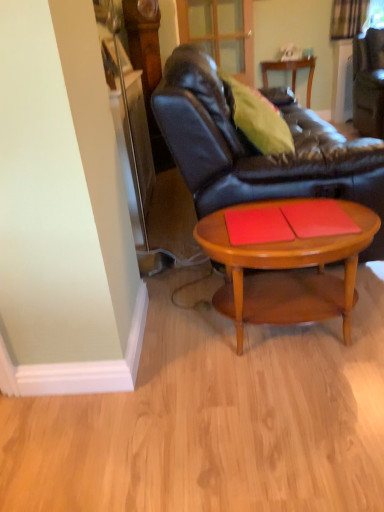
What are the coordinates of `red matte placemat at center, the second plank viewed from the left` in the screenshot? It's located at (318, 218).

In order to face wooden table at center, should I rotate leftwards or rightwards?

You should look right and rotate roughly 12.982 degrees.

Locate an element on the screen. red matte book at center, which ranks as the 2th plank in right-to-left order is located at coordinates (257, 225).

The height and width of the screenshot is (512, 384). I want to click on red matte placemat at center, the first plank from the right, so click(318, 218).

Is light brown wood coffee table at center at the right side of red matte placemat at center, the first plank from the right?

No, light brown wood coffee table at center is not to the right of red matte placemat at center, the first plank from the right.

Which is correct: light brown wood coffee table at center is inside red matte placemat at center, the first plank from the right, or outside of it?

light brown wood coffee table at center is not enclosed by red matte placemat at center, the first plank from the right.

Which object is thinner, light brown wood coffee table at center or red matte placemat at center, the second plank viewed from the left?

Thinner between the two is red matte placemat at center, the second plank viewed from the left.

Is wooden table at center closer to camera compared to red matte placemat at center, the first plank from the right?

That is False.

From a real-world perspective, is wooden table at center located beneath red matte placemat at center, the second plank viewed from the left?

Yes, from a real-world perspective, wooden table at center is beneath red matte placemat at center, the second plank viewed from the left.

From the image's perspective, between wooden table at center and red matte placemat at center, the first plank from the right, which one is located above?

From the image's view, wooden table at center is above.

Is wooden table at center next to red matte placemat at center, the first plank from the right, and touching it?

wooden table at center and red matte placemat at center, the first plank from the right, are clearly separated.

From the picture: Which object is wider, red matte book at center, which ranks as the 2th plank in right-to-left order, or light brown wood coffee table at center?

light brown wood coffee table at center is wider.

Is red matte book at center, the first plank when ordered from left to right, bigger or smaller than light brown wood coffee table at center?

Considering their sizes, red matte book at center, the first plank when ordered from left to right, takes up less space than light brown wood coffee table at center.

Is red matte book at center, the first plank when ordered from left to right, outside of light brown wood coffee table at center?

red matte book at center, the first plank when ordered from left to right, lies outside light brown wood coffee table at center's area.

From a real-world perspective, relative to light brown wood coffee table at center, is red matte book at center, the first plank when ordered from left to right, vertically above or below?

From a real-world perspective, red matte book at center, the first plank when ordered from left to right, is physically above light brown wood coffee table at center.

Looking at this image, from a real-world perspective, does wooden table at center stand above light brown wood coffee table at center?

Yes, from a real-world perspective, wooden table at center is above light brown wood coffee table at center.

Do you think wooden table at center is within light brown wood coffee table at center, or outside of it?

wooden table at center cannot be found inside light brown wood coffee table at center.

Between wooden table at center and light brown wood coffee table at center, which one has less height?

Standing shorter between the two is light brown wood coffee table at center.

Is leather couch at center not within light brown wood coffee table at center?

leather couch at center is positioned outside light brown wood coffee table at center.

Which of these two, leather couch at center or light brown wood coffee table at center, is bigger?

leather couch at center is bigger.

Is leather couch at center positioned in front of light brown wood coffee table at center?

No, leather couch at center is further to the viewer.

From a real-world perspective, who is located lower, wooden table at center or red matte book at center, which ranks as the 2th plank in right-to-left order?

In real-world perspective, wooden table at center is lower.

Is red matte book at center, the first plank when ordered from left to right, at the back of wooden table at center?

No, wooden table at center is not facing away from red matte book at center, the first plank when ordered from left to right.

Which object is thinner, wooden table at center or red matte book at center, which ranks as the 2th plank in right-to-left order?

red matte book at center, which ranks as the 2th plank in right-to-left order, is thinner.

Considering the points (308, 85) and (258, 237), which point is in front, point (308, 85) or point (258, 237)?

The point (258, 237) is closer.

Where is `studio couch above the light brown wood coffee table at center (from the image's perspective)`? The width and height of the screenshot is (384, 512). studio couch above the light brown wood coffee table at center (from the image's perspective) is located at coordinates (256, 150).

How different are the orientations of light brown wood coffee table at center and leather couch at center in degrees?

90 degrees.

Does light brown wood coffee table at center appear on the right side of leather couch at center?

No, light brown wood coffee table at center is not to the right of leather couch at center.

Which of these two, light brown wood coffee table at center or leather couch at center, is bigger?

leather couch at center is bigger.

From a real-world perspective, which plank is the 1st one above the light brown wood coffee table at center? Please provide its 2D coordinates.

[(318, 218)]

This screenshot has width=384, height=512. Identify the location of plank that is the 1st one when counting leftward from the wooden table at center. 318,218.

Based on the photo, when comparing their distances from red matte placemat at center, the first plank from the right, does light brown wood coffee table at center or leather couch at center seem closer?

light brown wood coffee table at center is positioned closer to the anchor red matte placemat at center, the first plank from the right.

From the image, which object appears to be farther from light brown wood coffee table at center, red matte placemat at center, the second plank viewed from the left, or red matte book at center, the first plank when ordered from left to right?

red matte placemat at center, the second plank viewed from the left, lies further to light brown wood coffee table at center than the other object.

Considering their positions, is wooden table at center positioned closer to leather couch at center than light brown wood coffee table at center?

light brown wood coffee table at center is positioned closer to the anchor leather couch at center.

Estimate the real-world distances between objects in this image. Which object is closer to leather couch at center, red matte placemat at center, the second plank viewed from the left, or red matte book at center, the first plank when ordered from left to right?

Based on the image, red matte placemat at center, the second plank viewed from the left, appears to be nearer to leather couch at center.

Considering their positions, is red matte placemat at center, the first plank from the right, positioned closer to leather couch at center than light brown wood coffee table at center?

Based on the image, light brown wood coffee table at center appears to be nearer to leather couch at center.

Based on their spatial positions, is wooden table at center or leather couch at center closer to red matte placemat at center, the first plank from the right?

leather couch at center is positioned closer to the anchor red matte placemat at center, the first plank from the right.

Which object lies further to the anchor point wooden table at center, red matte placemat at center, the first plank from the right, or red matte book at center, which ranks as the 2th plank in right-to-left order?

red matte book at center, which ranks as the 2th plank in right-to-left order, lies further to wooden table at center than the other object.

Which object lies nearer to the anchor point red matte book at center, the first plank when ordered from left to right, red matte placemat at center, the first plank from the right, or light brown wood coffee table at center?

red matte placemat at center, the first plank from the right, lies closer to red matte book at center, the first plank when ordered from left to right, than the other object.

Locate an element on the screen. This screenshot has height=512, width=384. studio couch located between red matte placemat at center, the second plank viewed from the left, and wooden table at center in the depth direction is located at coordinates (256, 150).

This screenshot has height=512, width=384. In order to click on studio couch positioned between light brown wood coffee table at center and wooden table at center from near to far in this screenshot , I will do `click(256, 150)`.

You are a GUI agent. You are given a task and a screenshot of the screen. Output one action in this format:
    pyautogui.click(x=<x>, y=<y>)
    Task: Click on the studio couch between red matte book at center, which ranks as the 2th plank in right-to-left order, and wooden table at center, along the z-axis
    The width and height of the screenshot is (384, 512).
    Given the screenshot: What is the action you would take?
    pyautogui.click(x=256, y=150)

Identify the location of plank positioned between red matte placemat at center, the second plank viewed from the left, and wooden table at center from near to far. The image size is (384, 512). (257, 225).